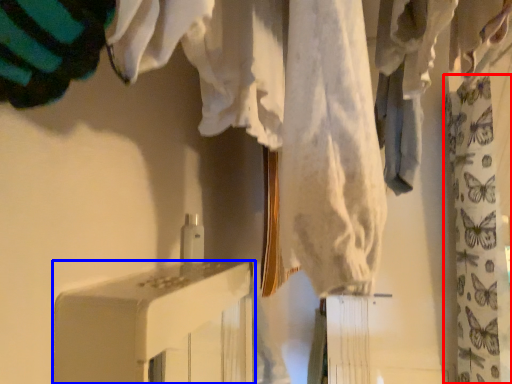
Question: Which point is further to the camera, curtain (highlighted by a red box) or furniture (highlighted by a blue box)?

Choices:
 (A) curtain
 (B) furniture

Answer: (A)